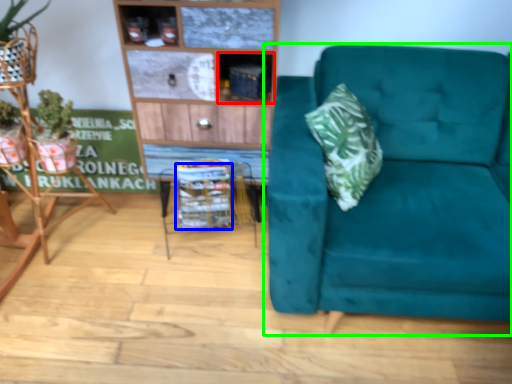
Question: Which is nearer to the cabinet (highlighted by a red box)? basket (highlighted by a blue box) or studio couch (highlighted by a green box).

Choices:
 (A) basket
 (B) studio couch

Answer: (A)